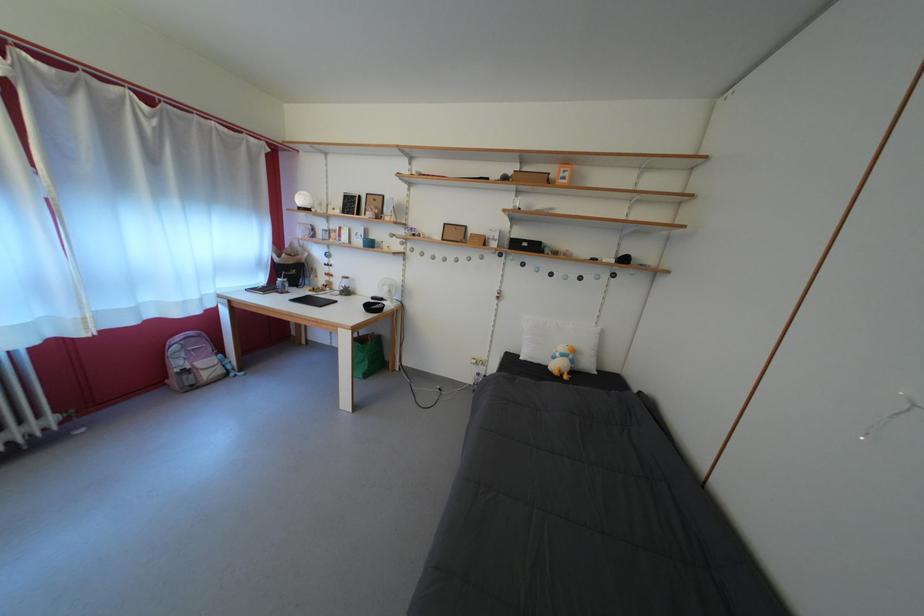
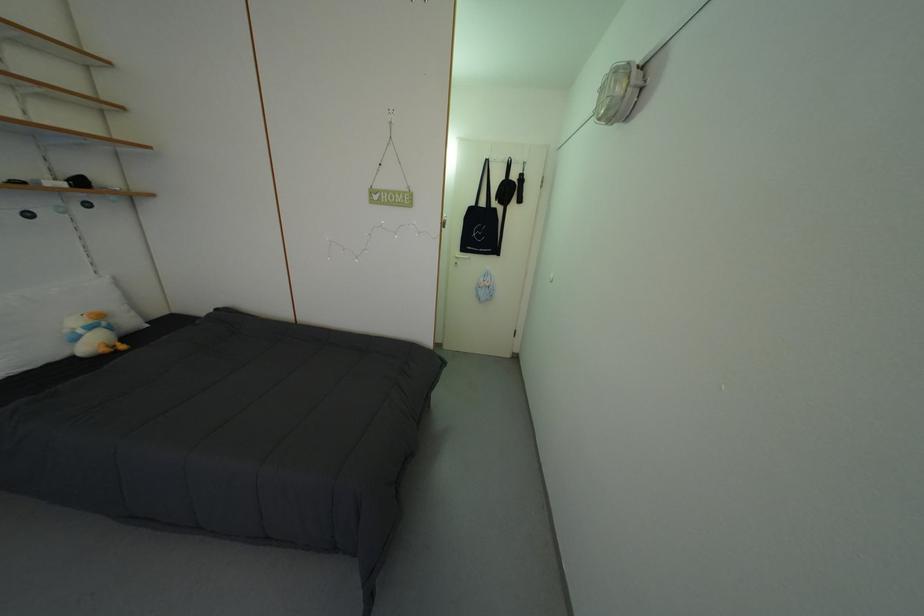
First-person continuous shooting, in which direction is the camera rotating?

The camera's rotation is toward right-down.